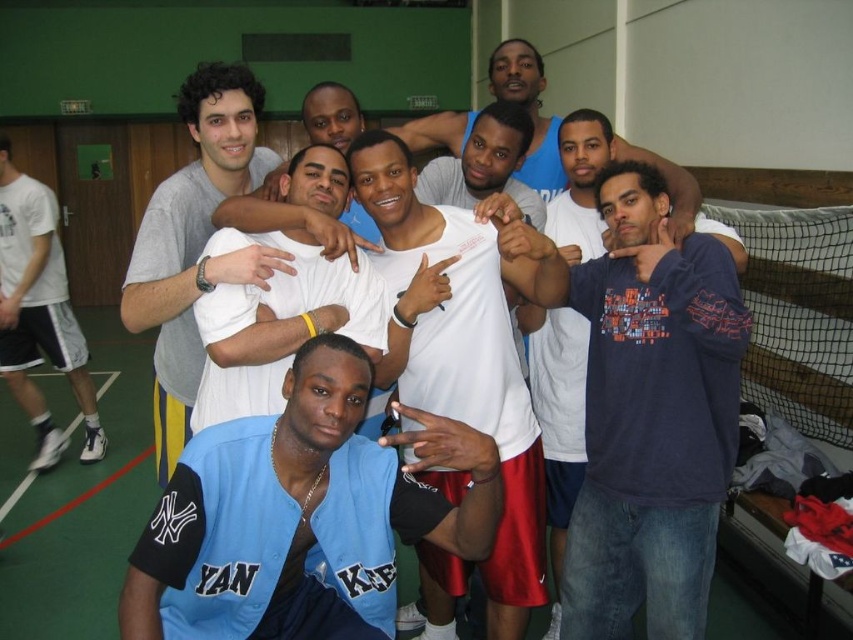
You are a photographer setting up for a group photo at the gym. You need to ensure that the light blue jersey at center and the white matte shirt at center are both visible in the frame. Given their heights, which one might you need to ask to stand slightly taller to ensure both are visible?

The light blue jersey at center is shorter than the white matte shirt at center, so you should ask the person in the light blue jersey at center to stand slightly taller to ensure both are visible.

You are standing at point (308, 237) in the gymnasium. You want to walk to the wooden door located in the background. If you walk straight ahead, will you pass through point (486, 467) first?

Yes, because point (486, 467) is in front of point (308, 237), so walking straight towards the door would first pass through point (486, 467).